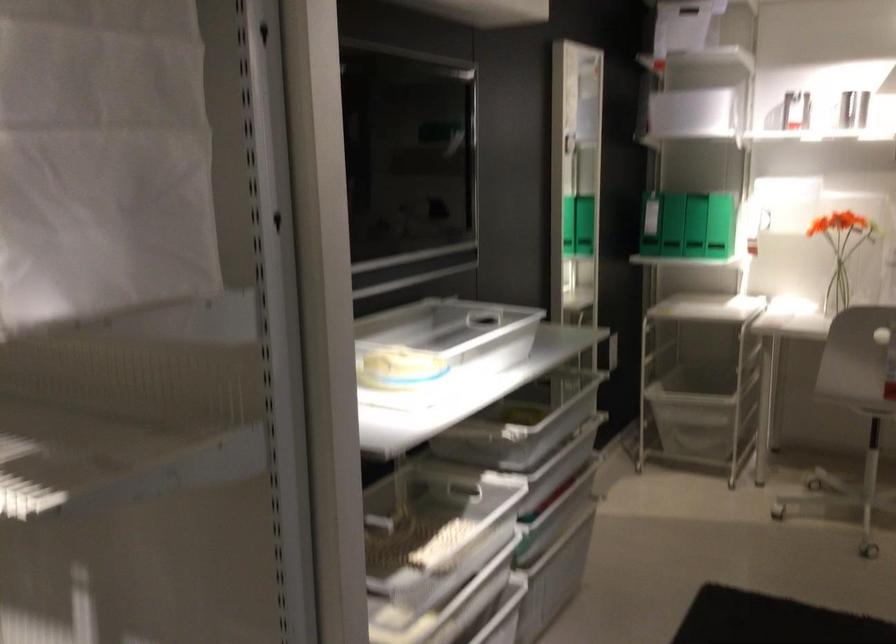
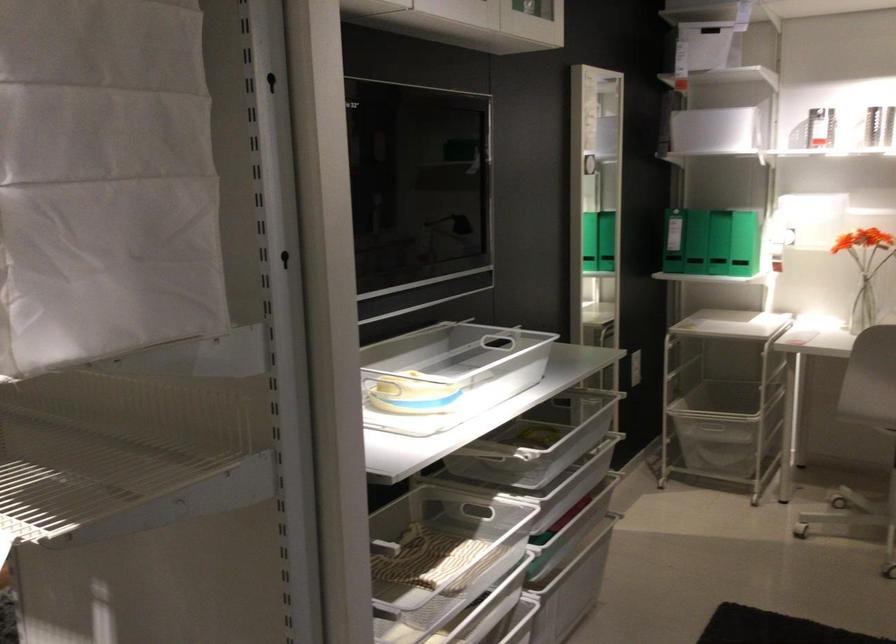
Where in the second image is the point corresponding to point (434, 522) from the first image?

(441, 544)